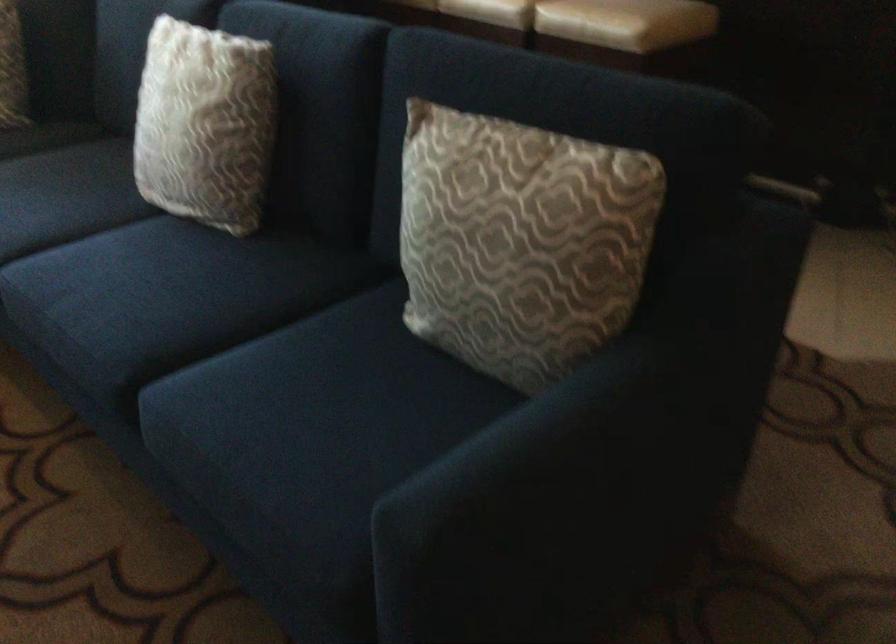
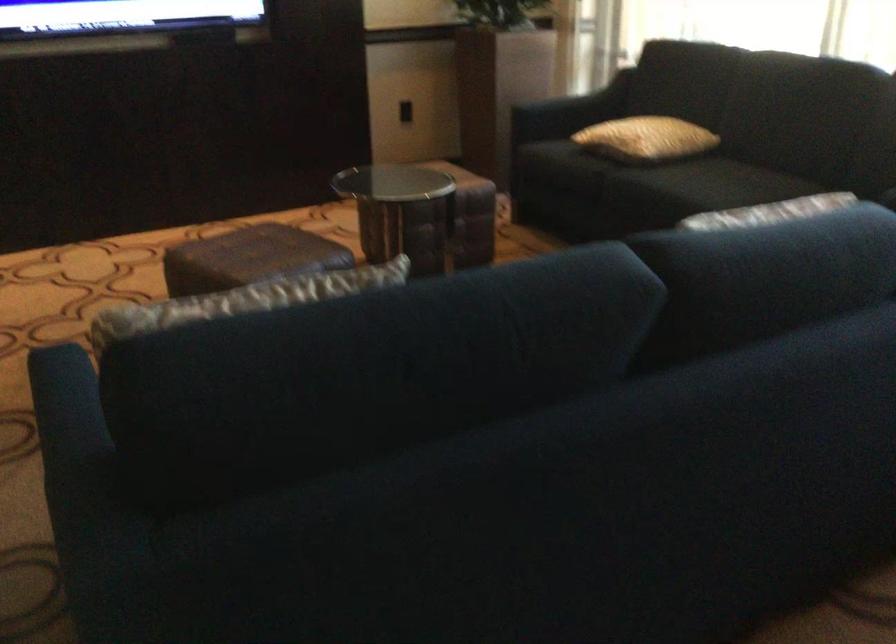
In the second image, find the point that corresponds to (x=524, y=138) in the first image.

(252, 298)